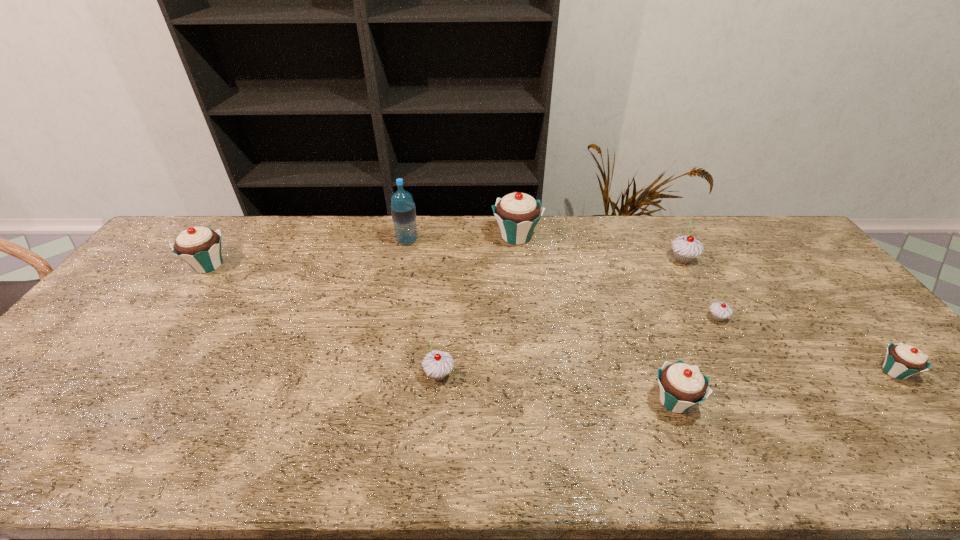
Identify the location of blank space located 0.280m on the right of the fourth cupcake from left to right. The height and width of the screenshot is (540, 960). (818, 401).

The height and width of the screenshot is (540, 960). Identify the location of free region located on the right of the fifth farthest object. (816, 318).

Locate an element on the screen. Image resolution: width=960 pixels, height=540 pixels. vacant region located on the left of the rightmost teal cupcake is located at coordinates (722, 372).

Find the location of a particular element. The width and height of the screenshot is (960, 540). water bottle situated at the far edge is located at coordinates (403, 211).

Locate an element on the screen. The height and width of the screenshot is (540, 960). object that is at the left edge is located at coordinates (200, 247).

Identify the location of object positioned at the right edge. (902, 361).

Where is `object situated at the far left corner`? This screenshot has width=960, height=540. object situated at the far left corner is located at coordinates coord(200,247).

In the image, there is a desktop. Identify the location of vacant space at the far edge. (324, 233).

The width and height of the screenshot is (960, 540). In the image, there is a desktop. Identify the location of vacant space at the near edge. (315, 445).

You are a GUI agent. You are given a task and a screenshot of the screen. Output one action in this format:
    pyautogui.click(x=<x>, y=<y>)
    Task: Click on the vacant space at the right edge
    The width and height of the screenshot is (960, 540).
    Given the screenshot: What is the action you would take?
    pyautogui.click(x=840, y=355)